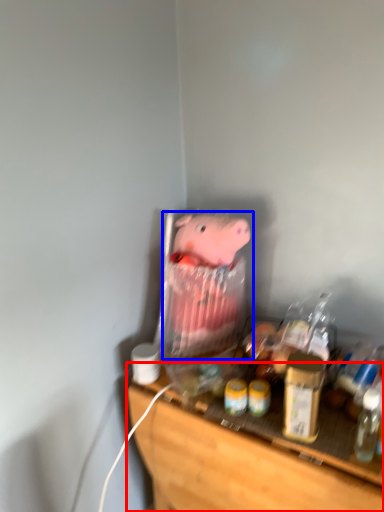
Question: Which of the following is the farthest to the observer, furniture (highlighted by a red box) or toy (highlighted by a blue box)?

Choices:
 (A) furniture
 (B) toy

Answer: (B)